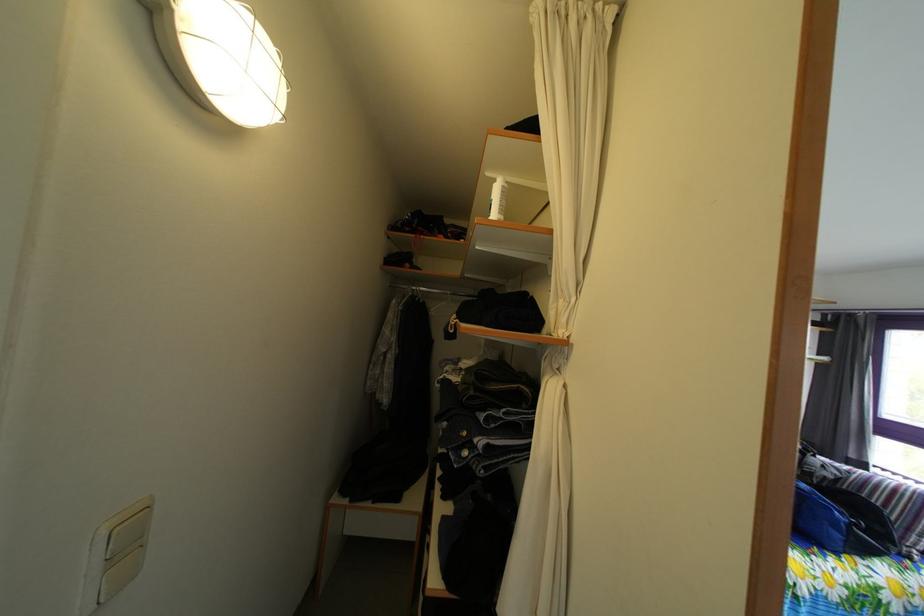
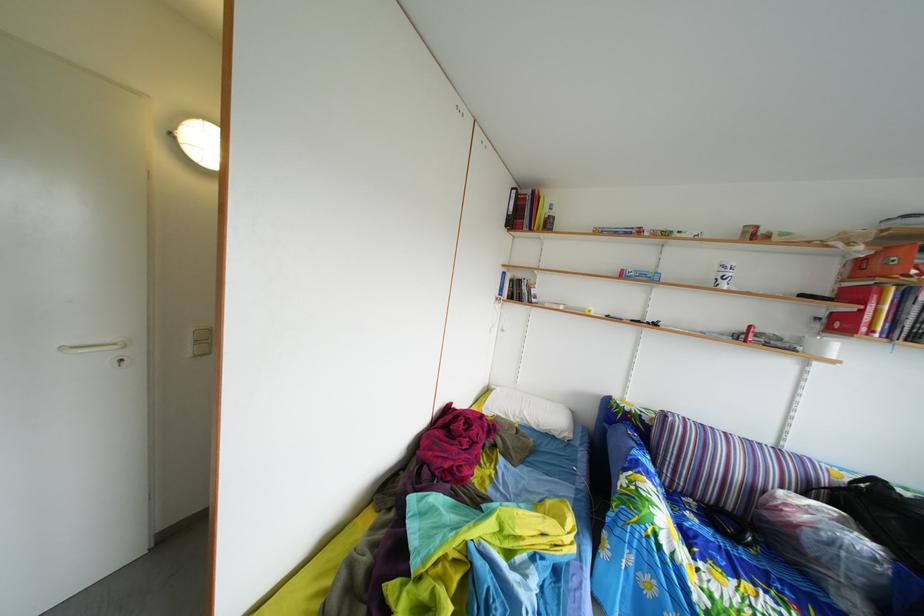
Question: I am providing you with two images of the same scene from different viewpoints. Please identify which objects are invisible in image2.

Choices:
 (A) white curtain
 (B) plastic water bottle
 (C) striped pillow
 (D) blue trackball mouse

Answer: (A)